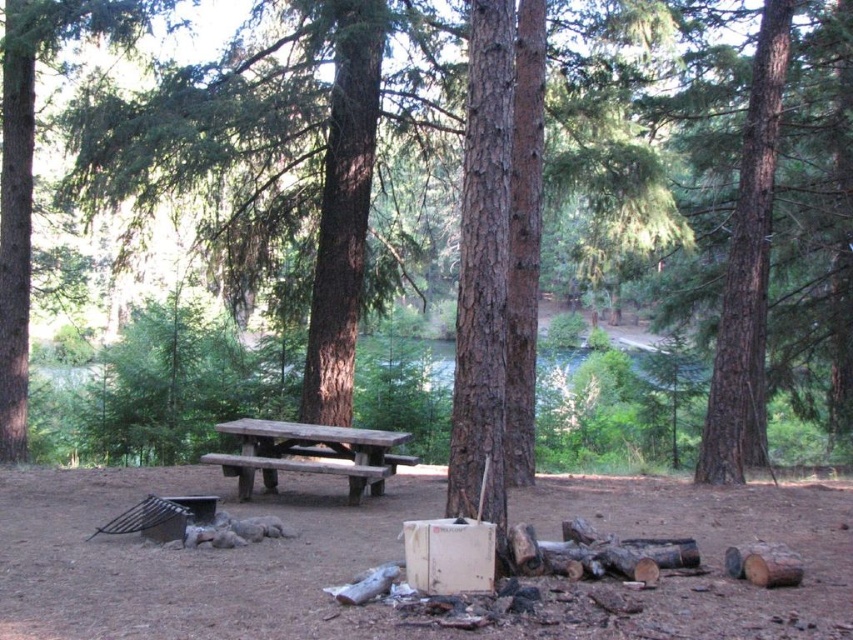
Based on the photo, you are setting up a tent in the camping area and need to choose between placing it under the green rough bark tree at left or near the wooden picnic table at center. Based on their heights, which location would provide more vertical space for your tent?

The green rough bark tree at left is taller than the wooden picnic table at center, so placing the tent under the tree would provide more vertical space due to its greater height.

You are planning to set up a tent in this camping area. The green rough bark tree at left and the wooden picnic table at center are in your way. Which one should you move to make more space for the tent?

The green rough bark tree at left has a larger size compared to the wooden picnic table at center, so you should move the wooden picnic table at center to make more space for the tent since it is smaller and easier to relocate.

You are setting up a tent in the camping area and need to determine the best spot. Considering the green rough bark tree at left and the wooden picnic table at center, which object is positioned higher relative to the other?

The green rough bark tree at left is located above the wooden picnic table at center, so it is positioned higher.